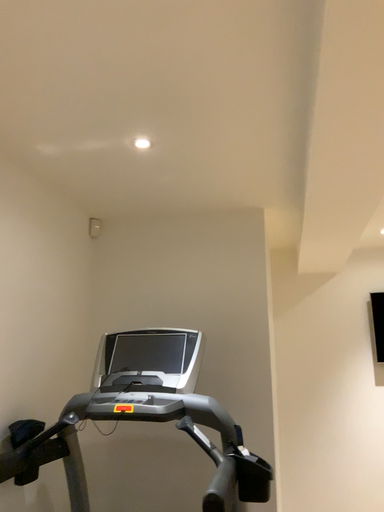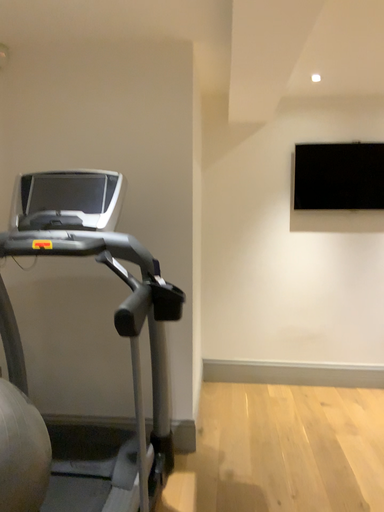
Question: How did the camera likely rotate when shooting the video?

Choices:
 (A) rotated left
 (B) rotated right

Answer: (B)